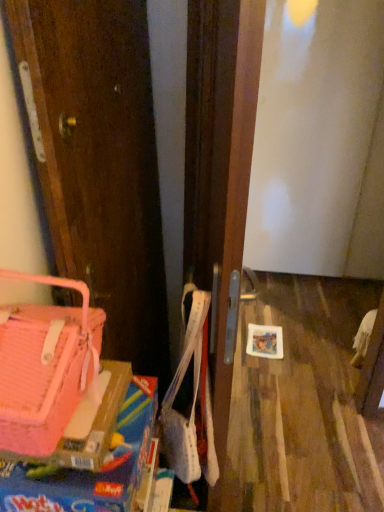
Question: Is pink fabric handbag at left in contact with pink plastic box at lower left?

Choices:
 (A) yes
 (B) no

Answer: (B)

Question: Is pink fabric handbag at left smaller than pink plastic box at lower left?

Choices:
 (A) yes
 (B) no

Answer: (B)

Question: Is pink fabric handbag at left shorter than pink plastic box at lower left?

Choices:
 (A) yes
 (B) no

Answer: (B)

Question: Can you confirm if pink fabric handbag at left is positioned to the left of pink plastic box at lower left?

Choices:
 (A) no
 (B) yes

Answer: (B)

Question: From a real-world perspective, does pink fabric handbag at left sit lower than pink plastic box at lower left?

Choices:
 (A) yes
 (B) no

Answer: (B)

Question: Does pink fabric handbag at left turn towards pink plastic box at lower left?

Choices:
 (A) yes
 (B) no

Answer: (B)

Question: Is the depth of pink plastic box at lower left less than that of pink fabric handbag at left?

Choices:
 (A) no
 (B) yes

Answer: (A)

Question: Are pink plastic box at lower left and pink fabric handbag at left beside each other?

Choices:
 (A) yes
 (B) no

Answer: (B)

Question: Is pink plastic box at lower left aimed at pink fabric handbag at left?

Choices:
 (A) no
 (B) yes

Answer: (A)

Question: From a real-world perspective, is pink plastic box at lower left located beneath pink fabric handbag at left?

Choices:
 (A) yes
 (B) no

Answer: (A)

Question: Is pink plastic box at lower left turned away from pink fabric handbag at left?

Choices:
 (A) yes
 (B) no

Answer: (B)

Question: Is pink plastic box at lower left behind pink fabric handbag at left?

Choices:
 (A) yes
 (B) no

Answer: (A)

Question: Considering the positions of pink fabric handbag at left and pink plastic box at lower left in the image, is pink fabric handbag at left taller or shorter than pink plastic box at lower left?

Choices:
 (A) short
 (B) tall

Answer: (B)